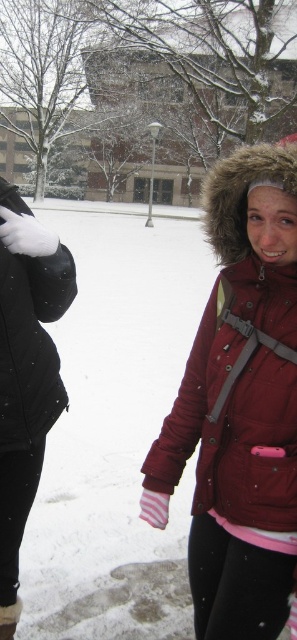
You are standing at the point labeled as point (226, 538) in the snowy scene. If you want to take a photo of the lamppost that is 2.06 meters away from you, where should you aim your camera?

You should aim your camera towards the lamppost since the point (226, 538) is 2.06 meters away from the camera, which is the distance needed to capture the lamppost in the photo.

You are a photographer trying to capture both the matte red jacket at right and the black matte jacket at left in a single shot. Given their heights, which jacket would appear larger in the photo?

The black matte jacket at left is taller than the matte red jacket at right, so it would appear larger in the photo.

You are standing in the snowy scene and want to walk towards the two points marked in the image. Which point, point (228, 296) or point (15, 209), will you reach first?

Point (228, 296) is closer to the viewer than point (15, 209), so you will reach point (228, 296) first.